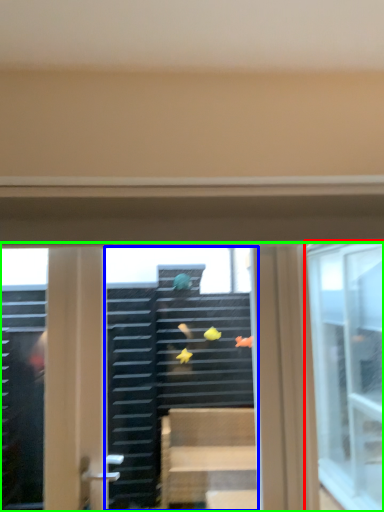
Question: Estimate the real-world distances between objects in this image. Which object is farther from window (highlighted by a red box), shop window (highlighted by a blue box) or window (highlighted by a green box)?

Choices:
 (A) shop window
 (B) window

Answer: (A)